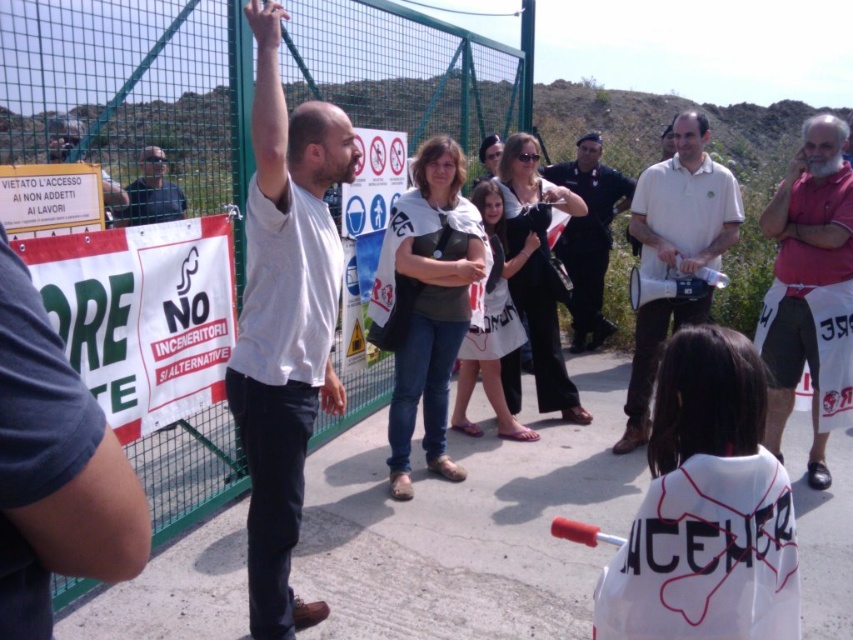
Can you confirm if dark gray uniform at center is positioned above matte white shirt at upper left?

No.

Does dark gray uniform at center have a greater height compared to matte white shirt at upper left?

Yes, dark gray uniform at center is taller than matte white shirt at upper left.

At what (x,y) coordinates should I click in order to perform the action: click on dark gray uniform at center. Please return your answer as a coordinate pair (x, y). This screenshot has width=853, height=640. Looking at the image, I should click on (589, 236).

Looking at this image, who is positioned more to the right, green wire mesh fence at upper left or white cotton shirt at center?

green wire mesh fence at upper left is more to the right.

Does green wire mesh fence at upper left have a greater width compared to white cotton shirt at center?

Indeed, green wire mesh fence at upper left has a greater width compared to white cotton shirt at center.

The height and width of the screenshot is (640, 853). I want to click on green wire mesh fence at upper left, so click(137, 93).

Where is `green wire mesh fence at upper left`? The image size is (853, 640). green wire mesh fence at upper left is located at coordinates (137, 93).

This screenshot has height=640, width=853. Describe the element at coordinates (805, 278) in the screenshot. I see `white cotton shirt at right` at that location.

Which is above, white cotton shirt at right or yellow paper sign at upper left?

Positioned higher is yellow paper sign at upper left.

At what (x,y) coordinates should I click in order to perform the action: click on white cotton shirt at right. Please return your answer as a coordinate pair (x, y). This screenshot has width=853, height=640. Looking at the image, I should click on (805, 278).

I want to click on white cotton shirt at right, so click(x=805, y=278).